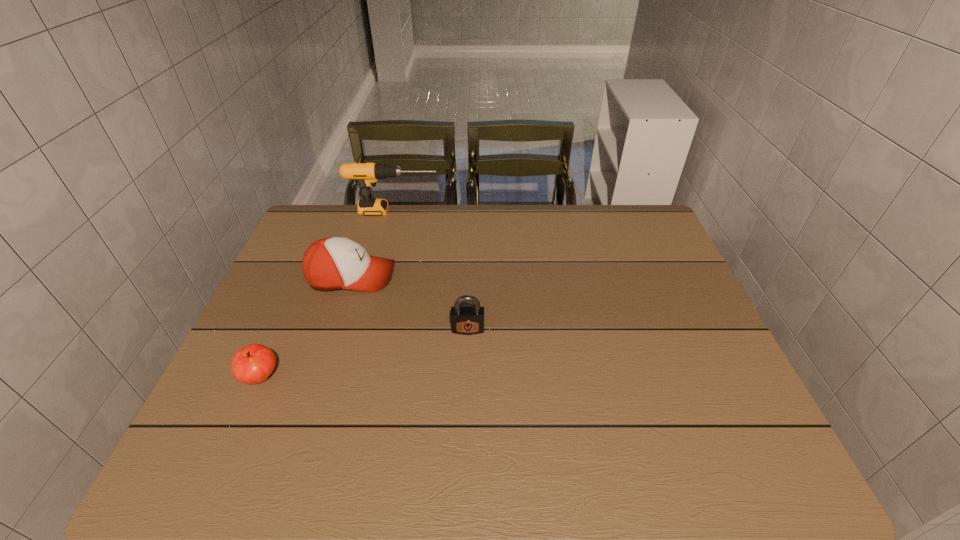
This screenshot has width=960, height=540. In order to click on vacant space that's between the nearest object and the third farthest object in this screenshot , I will do `click(365, 353)`.

Locate which object ranks second in proximity to the drill. Please provide its 2D coordinates. Your answer should be formatted as a tuple, i.e. [(x, y)], where the tuple contains the x and y coordinates of a point satisfying the conditions above.

[(466, 320)]

Choose which object is the third nearest neighbor to the third nearest object. Please provide its 2D coordinates. Your answer should be formatted as a tuple, i.e. [(x, y)], where the tuple contains the x and y coordinates of a point satisfying the conditions above.

[(367, 174)]

The height and width of the screenshot is (540, 960). I want to click on free space that satisfies the following two spatial constraints: 1. on the front-facing side of the baseball cap; 2. on the front side of the nearest object, so [x=319, y=377].

Find the location of `free space that satisfies the following two spatial constraints: 1. on the handle side of the tallest object; 2. on the front side of the apple`. free space that satisfies the following two spatial constraints: 1. on the handle side of the tallest object; 2. on the front side of the apple is located at coordinates (351, 377).

What are the coordinates of `vacant region that satisfies the following two spatial constraints: 1. on the front-facing side of the second farthest object; 2. on the front side of the shortest object` in the screenshot? It's located at (319, 377).